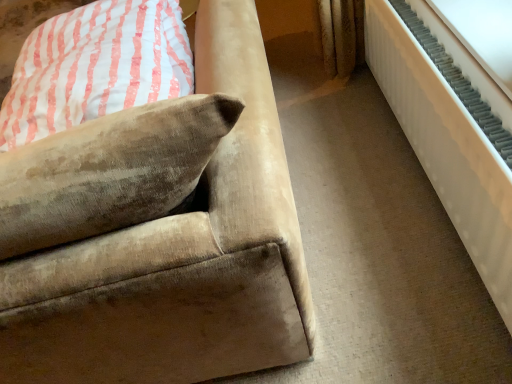
Question: Is white textured radiator at right at the right side of velvet beige pillow at upper left?

Choices:
 (A) yes
 (B) no

Answer: (A)

Question: Considering the relative sizes of white textured radiator at right and velvet beige pillow at upper left in the image provided, is white textured radiator at right bigger than velvet beige pillow at upper left?

Choices:
 (A) no
 (B) yes

Answer: (A)

Question: Would you say white textured radiator at right is a long distance from velvet beige pillow at upper left?

Choices:
 (A) yes
 (B) no

Answer: (B)

Question: Is velvet beige pillow at upper left surrounded by white textured radiator at right?

Choices:
 (A) yes
 (B) no

Answer: (B)

Question: Considering the relative positions of white textured radiator at right and velvet beige pillow at upper left in the image provided, is white textured radiator at right in front of velvet beige pillow at upper left?

Choices:
 (A) yes
 (B) no

Answer: (A)

Question: Considering the relative sizes of white textured radiator at right and velvet beige pillow at upper left in the image provided, is white textured radiator at right taller than velvet beige pillow at upper left?

Choices:
 (A) no
 (B) yes

Answer: (B)

Question: From the image's perspective, is velvet beige couch at lower left beneath white textured radiator at right?

Choices:
 (A) yes
 (B) no

Answer: (B)

Question: Considering the relative sizes of velvet beige couch at lower left and white textured radiator at right in the image provided, is velvet beige couch at lower left smaller than white textured radiator at right?

Choices:
 (A) no
 (B) yes

Answer: (A)

Question: Does velvet beige couch at lower left contain white textured radiator at right?

Choices:
 (A) no
 (B) yes

Answer: (A)

Question: From a real-world perspective, is velvet beige couch at lower left below white textured radiator at right?

Choices:
 (A) no
 (B) yes

Answer: (A)

Question: From the image's perspective, is velvet beige couch at lower left on top of white textured radiator at right?

Choices:
 (A) yes
 (B) no

Answer: (A)

Question: Is velvet beige couch at lower left thinner than white textured radiator at right?

Choices:
 (A) yes
 (B) no

Answer: (B)

Question: Is velvet beige couch at lower left facing away from velvet beige pillow at upper left?

Choices:
 (A) yes
 (B) no

Answer: (A)